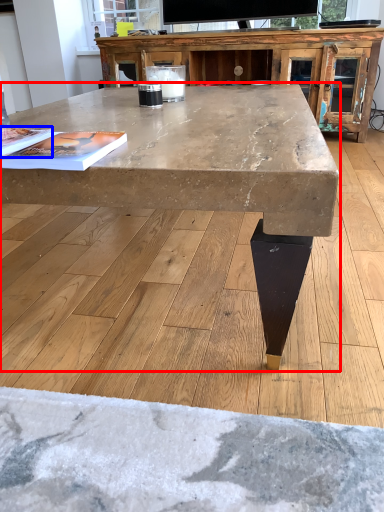
Question: Which object is further to the camera taking this photo, coffee table (highlighted by a red box) or magazine (highlighted by a blue box)?

Choices:
 (A) coffee table
 (B) magazine

Answer: (B)